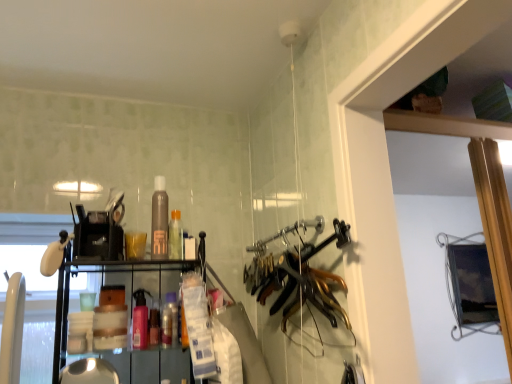
At what (x,y) coordinates should I click in order to perform the action: click on gold metallic hangers at center. Please return your answer as a coordinate pair (x, y). Looking at the image, I should click on (298, 276).

Measure the distance between pink matte spray bottle at center, arranged as the third bottle when viewed from the top, and camera.

4.13 feet.

How much space does translucent plastic bottle at center, the second bottle when ordered from top to bottom, occupy horizontally?

translucent plastic bottle at center, the second bottle when ordered from top to bottom, is 3.07 inches in width.

At what (x,y) coordinates should I click in order to perform the action: click on gold metallic hangers at center. Please return your answer as a coordinate pair (x, y). Looking at the image, I should click on (298, 276).

Which is correct: translucent plastic bottle at center, positioned as the first bottle in bottom-to-top order, is inside translucent plastic bottle at center, which ranks as the 3th bottle in bottom-to-top order, or outside of it?

translucent plastic bottle at center, positioned as the first bottle in bottom-to-top order, is not enclosed by translucent plastic bottle at center, which ranks as the 3th bottle in bottom-to-top order.

Does translucent plastic bottle at center, positioned as the 4th bottle in top-to-bottom order, have a larger size compared to translucent plastic bottle at center, the second bottle when ordered from top to bottom?

Incorrect, translucent plastic bottle at center, positioned as the 4th bottle in top-to-bottom order, is not larger than translucent plastic bottle at center, the second bottle when ordered from top to bottom.

From the image's perspective, is translucent plastic bottle at center, positioned as the first bottle in bottom-to-top order, above or below translucent plastic bottle at center, which ranks as the 3th bottle in bottom-to-top order?

translucent plastic bottle at center, positioned as the first bottle in bottom-to-top order, is below translucent plastic bottle at center, which ranks as the 3th bottle in bottom-to-top order.

The height and width of the screenshot is (384, 512). Identify the location of bottle that is the 2nd one when counting upward from the translucent plastic bottle at center, positioned as the first bottle in bottom-to-top order (from the image's perspective). (175, 236).

Relative to gold metallic hangers at center, is pink matte spray bottle at center, which ranks as the 2th bottle in bottom-to-top order, in front or behind?

pink matte spray bottle at center, which ranks as the 2th bottle in bottom-to-top order, is behind gold metallic hangers at center.

From the image's perspective, which one is positioned lower, pink matte spray bottle at center, which ranks as the 2th bottle in bottom-to-top order, or gold metallic hangers at center?

pink matte spray bottle at center, which ranks as the 2th bottle in bottom-to-top order, is shown below in the image.

Can you confirm if pink matte spray bottle at center, arranged as the third bottle when viewed from the top, is positioned to the left of gold metallic hangers at center?

Indeed, pink matte spray bottle at center, arranged as the third bottle when viewed from the top, is positioned on the left side of gold metallic hangers at center.

In terms of width, does pink matte spray bottle at center, arranged as the third bottle when viewed from the top, look wider or thinner when compared to gold metallic hangers at center?

Considering their sizes, pink matte spray bottle at center, arranged as the third bottle when viewed from the top, looks slimmer than gold metallic hangers at center.

Who is bigger, brown matte bottle at center, which appears as the 1th bottle when viewed from the top, or translucent plastic bottle at center, the second bottle when ordered from top to bottom?

translucent plastic bottle at center, the second bottle when ordered from top to bottom.

Does point (161, 185) come closer to viewer compared to point (172, 259)?

No, (161, 185) is further to viewer.

In the image, is brown matte bottle at center, which appears as the 1th bottle when viewed from the top, positioned in front of or behind translucent plastic bottle at center, which ranks as the 3th bottle in bottom-to-top order?

brown matte bottle at center, which appears as the 1th bottle when viewed from the top, is positioned closer to the viewer than translucent plastic bottle at center, which ranks as the 3th bottle in bottom-to-top order.

Is brown matte bottle at center, which appears as the 1th bottle when viewed from the top, aimed at translucent plastic bottle at center, which ranks as the 3th bottle in bottom-to-top order?

No, brown matte bottle at center, which appears as the 1th bottle when viewed from the top, is not aimed at translucent plastic bottle at center, which ranks as the 3th bottle in bottom-to-top order.

Who is taller, pink matte spray bottle at center, arranged as the third bottle when viewed from the top, or translucent plastic bottle at center, positioned as the 4th bottle in top-to-bottom order?

pink matte spray bottle at center, arranged as the third bottle when viewed from the top.

Is there a large distance between pink matte spray bottle at center, which ranks as the 2th bottle in bottom-to-top order, and translucent plastic bottle at center, positioned as the first bottle in bottom-to-top order?

That's not correct — pink matte spray bottle at center, which ranks as the 2th bottle in bottom-to-top order, is a little close to translucent plastic bottle at center, positioned as the first bottle in bottom-to-top order.

Is translucent plastic bottle at center, positioned as the 4th bottle in top-to-bottom order, at the back of pink matte spray bottle at center, which ranks as the 2th bottle in bottom-to-top order?

That's not correct — pink matte spray bottle at center, which ranks as the 2th bottle in bottom-to-top order, is not looking away from translucent plastic bottle at center, positioned as the 4th bottle in top-to-bottom order.

Can you tell me how much pink matte spray bottle at center, which ranks as the 2th bottle in bottom-to-top order, and translucent plastic bottle at center, positioned as the first bottle in bottom-to-top order, differ in facing direction?

They differ by 0.00274 degrees in their facing directions.

Is translucent plastic bottle at center, which ranks as the 3th bottle in bottom-to-top order, behind translucent plastic bottle at center, positioned as the 4th bottle in top-to-bottom order?

Yes, translucent plastic bottle at center, which ranks as the 3th bottle in bottom-to-top order, is behind translucent plastic bottle at center, positioned as the 4th bottle in top-to-bottom order.

Is translucent plastic bottle at center, the second bottle when ordered from top to bottom, at the left side of translucent plastic bottle at center, positioned as the 4th bottle in top-to-bottom order?

In fact, translucent plastic bottle at center, the second bottle when ordered from top to bottom, is to the right of translucent plastic bottle at center, positioned as the 4th bottle in top-to-bottom order.

Which point is more forward, (x=177, y=237) or (x=173, y=333)?

Point (x=173, y=333)

Is translucent plastic bottle at center, which ranks as the 3th bottle in bottom-to-top order, completely or partially outside of translucent plastic bottle at center, positioned as the 4th bottle in top-to-bottom order?

Yes, translucent plastic bottle at center, which ranks as the 3th bottle in bottom-to-top order, is located beyond the bounds of translucent plastic bottle at center, positioned as the 4th bottle in top-to-bottom order.

Does pink matte spray bottle at center, which ranks as the 2th bottle in bottom-to-top order, turn towards brown matte bottle at center, which appears as the 1th bottle when viewed from the top?

No, pink matte spray bottle at center, which ranks as the 2th bottle in bottom-to-top order, is not aimed at brown matte bottle at center, which appears as the 1th bottle when viewed from the top.

Is pink matte spray bottle at center, which ranks as the 2th bottle in bottom-to-top order, located outside brown matte bottle at center, which appears as the 1th bottle when viewed from the top?

Absolutely, pink matte spray bottle at center, which ranks as the 2th bottle in bottom-to-top order, is external to brown matte bottle at center, which appears as the 1th bottle when viewed from the top.

You are a GUI agent. You are given a task and a screenshot of the screen. Output one action in this format:
    pyautogui.click(x=<x>, y=<y>)
    Task: Click on the 2nd bottle above when counting from the pink matte spray bottle at center, arranged as the third bottle when viewed from the top (from the image's perspective)
    
    Given the screenshot: What is the action you would take?
    pyautogui.click(x=159, y=220)

From a real-world perspective, which object stands above the other?

gold metallic hangers at center.

From the image's perspective, between gold metallic hangers at center and pink matte spray bottle at center, which ranks as the 2th bottle in bottom-to-top order, which one is located above?

From the image's view, gold metallic hangers at center is above.

Visually, is gold metallic hangers at center positioned to the left or to the right of pink matte spray bottle at center, arranged as the third bottle when viewed from the top?

In the image, gold metallic hangers at center appears on the right side of pink matte spray bottle at center, arranged as the third bottle when viewed from the top.

I want to click on bottle on the right of translucent plastic bottle at center, positioned as the first bottle in bottom-to-top order, so (x=175, y=236).

Where is `the 1st bottle behind the gold metallic hangers at center, counting from the anchor's position`? The height and width of the screenshot is (384, 512). the 1st bottle behind the gold metallic hangers at center, counting from the anchor's position is located at coordinates (140, 320).

Which object lies nearer to the anchor point translucent plastic bottle at center, positioned as the 4th bottle in top-to-bottom order, translucent plastic bottle at center, the second bottle when ordered from top to bottom, or brown matte bottle at center, which appears as the 1th bottle when viewed from the top?

The object closer to translucent plastic bottle at center, positioned as the 4th bottle in top-to-bottom order, is translucent plastic bottle at center, the second bottle when ordered from top to bottom.

Based on their spatial positions, is pink matte spray bottle at center, arranged as the third bottle when viewed from the top, or translucent plastic bottle at center, the second bottle when ordered from top to bottom, closer to gold metallic hangers at center?

translucent plastic bottle at center, the second bottle when ordered from top to bottom, lies closer to gold metallic hangers at center than the other object.

Which object lies further to the anchor point translucent plastic bottle at center, which ranks as the 3th bottle in bottom-to-top order, translucent plastic bottle at center, positioned as the 4th bottle in top-to-bottom order, or pink matte spray bottle at center, which ranks as the 2th bottle in bottom-to-top order?

pink matte spray bottle at center, which ranks as the 2th bottle in bottom-to-top order, lies further to translucent plastic bottle at center, which ranks as the 3th bottle in bottom-to-top order, than the other object.

Considering their positions, is brown matte bottle at center, which appears as the 1th bottle when viewed from the top, positioned closer to translucent plastic bottle at center, positioned as the first bottle in bottom-to-top order, than gold metallic hangers at center?

Based on the image, brown matte bottle at center, which appears as the 1th bottle when viewed from the top, appears to be nearer to translucent plastic bottle at center, positioned as the first bottle in bottom-to-top order.

From the image, which object appears to be nearer to translucent plastic bottle at center, which ranks as the 3th bottle in bottom-to-top order, pink matte spray bottle at center, which ranks as the 2th bottle in bottom-to-top order, or brown matte bottle at center, the 4th bottle when ordered from bottom to top?

brown matte bottle at center, the 4th bottle when ordered from bottom to top, is positioned closer to the anchor translucent plastic bottle at center, which ranks as the 3th bottle in bottom-to-top order.

Based on their spatial positions, is brown matte bottle at center, the 4th bottle when ordered from bottom to top, or translucent plastic bottle at center, positioned as the 4th bottle in top-to-bottom order, closer to gold metallic hangers at center?

The object closer to gold metallic hangers at center is translucent plastic bottle at center, positioned as the 4th bottle in top-to-bottom order.

From the image, which object appears to be farther from translucent plastic bottle at center, the second bottle when ordered from top to bottom, translucent plastic bottle at center, positioned as the 4th bottle in top-to-bottom order, or gold metallic hangers at center?

Based on the image, gold metallic hangers at center appears to be further to translucent plastic bottle at center, the second bottle when ordered from top to bottom.

Estimate the real-world distances between objects in this image. Which object is closer to translucent plastic bottle at center, the second bottle when ordered from top to bottom, brown matte bottle at center, which appears as the 1th bottle when viewed from the top, or pink matte spray bottle at center, which ranks as the 2th bottle in bottom-to-top order?

Based on the image, brown matte bottle at center, which appears as the 1th bottle when viewed from the top, appears to be nearer to translucent plastic bottle at center, the second bottle when ordered from top to bottom.

Identify the location of bottle between brown matte bottle at center, the 4th bottle when ordered from bottom to top, and pink matte spray bottle at center, arranged as the third bottle when viewed from the top, from top to bottom. (175, 236).

The width and height of the screenshot is (512, 384). Identify the location of bottle between translucent plastic bottle at center, positioned as the 4th bottle in top-to-bottom order, and gold metallic hangers at center. (175, 236).

Locate an element on the screen. bottle between translucent plastic bottle at center, which ranks as the 3th bottle in bottom-to-top order, and translucent plastic bottle at center, positioned as the 4th bottle in top-to-bottom order, in the vertical direction is located at coordinates (140, 320).